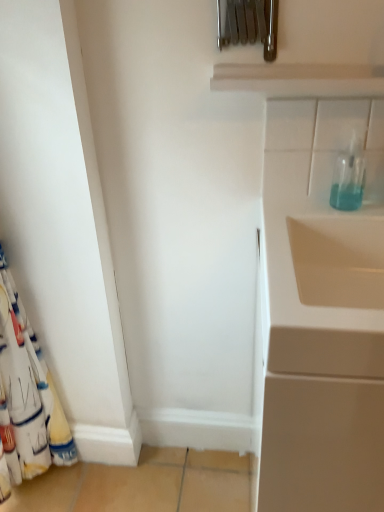
Question: Is white glossy cabinet at right not inside white fabric curtain at left?

Choices:
 (A) no
 (B) yes

Answer: (B)

Question: Could you tell me if white glossy cabinet at right is facing white fabric curtain at left?

Choices:
 (A) yes
 (B) no

Answer: (B)

Question: Is white glossy cabinet at right positioned with its back to white fabric curtain at left?

Choices:
 (A) yes
 (B) no

Answer: (B)

Question: Is white glossy cabinet at right to the right of white fabric curtain at left from the viewer's perspective?

Choices:
 (A) yes
 (B) no

Answer: (A)

Question: From a real-world perspective, is white glossy cabinet at right located beneath white fabric curtain at left?

Choices:
 (A) no
 (B) yes

Answer: (B)

Question: Does white glossy cabinet at right have a lesser height compared to white fabric curtain at left?

Choices:
 (A) yes
 (B) no

Answer: (A)

Question: Considering the relative positions of transparent glass bottle at upper right and white glossy cabinet at right in the image provided, is transparent glass bottle at upper right to the right of white glossy cabinet at right from the viewer's perspective?

Choices:
 (A) no
 (B) yes

Answer: (A)

Question: From the image's perspective, is transparent glass bottle at upper right on top of white glossy cabinet at right?

Choices:
 (A) yes
 (B) no

Answer: (A)

Question: Could you tell me if transparent glass bottle at upper right is turned towards white glossy cabinet at right?

Choices:
 (A) no
 (B) yes

Answer: (A)

Question: Is transparent glass bottle at upper right shorter than white glossy cabinet at right?

Choices:
 (A) no
 (B) yes

Answer: (B)

Question: Considering the relative sizes of transparent glass bottle at upper right and white glossy cabinet at right in the image provided, is transparent glass bottle at upper right thinner than white glossy cabinet at right?

Choices:
 (A) yes
 (B) no

Answer: (A)

Question: Is there a large distance between transparent glass bottle at upper right and white glossy cabinet at right?

Choices:
 (A) no
 (B) yes

Answer: (A)

Question: Is transparent glass bottle at upper right at the right side of white fabric curtain at left?

Choices:
 (A) no
 (B) yes

Answer: (B)